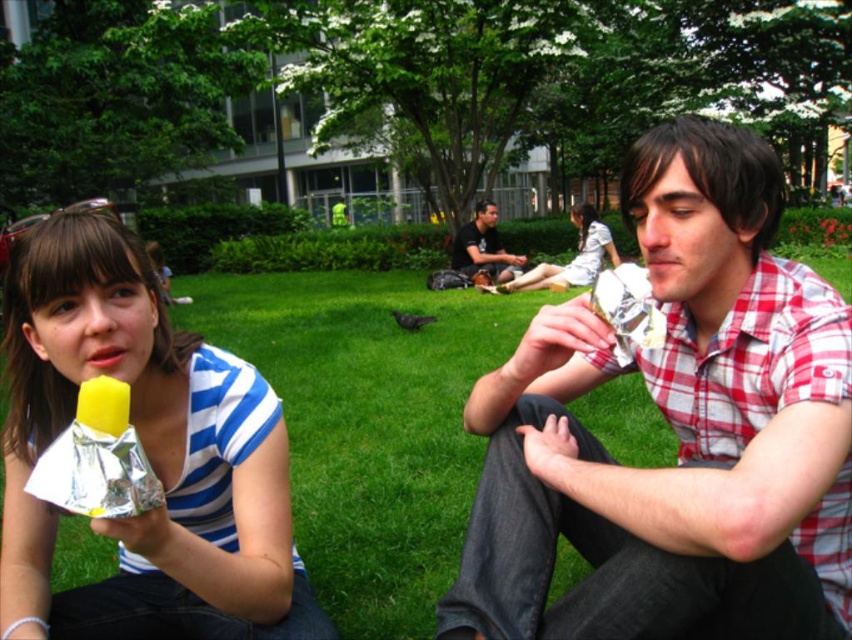
Which is more to the left, green grass at center or white cotton dress at center?

Positioned to the left is green grass at center.

Between green grass at center and white cotton dress at center, which one has more height?

white cotton dress at center is taller.

Is point (269, 326) farther from viewer compared to point (588, 227)?

That is False.

In order to click on green grass at center in this screenshot , I will do `click(369, 424)`.

Who is shorter, green grass at center or matte black shirt at center?

With less height is green grass at center.

The width and height of the screenshot is (852, 640). What do you see at coordinates (369, 424) in the screenshot?
I see `green grass at center` at bounding box center [369, 424].

Image resolution: width=852 pixels, height=640 pixels. I want to click on green grass at center, so click(x=369, y=424).

How much distance is there between matte red plaid shirt at center and green grass at center?

matte red plaid shirt at center and green grass at center are 1.97 meters apart.

What do you see at coordinates (675, 432) in the screenshot? The width and height of the screenshot is (852, 640). I see `matte red plaid shirt at center` at bounding box center [675, 432].

Does point (574, 616) come behind point (315, 372)?

No, (574, 616) is in front of (315, 372).

The image size is (852, 640). What are the coordinates of `matte red plaid shirt at center` in the screenshot? It's located at (675, 432).